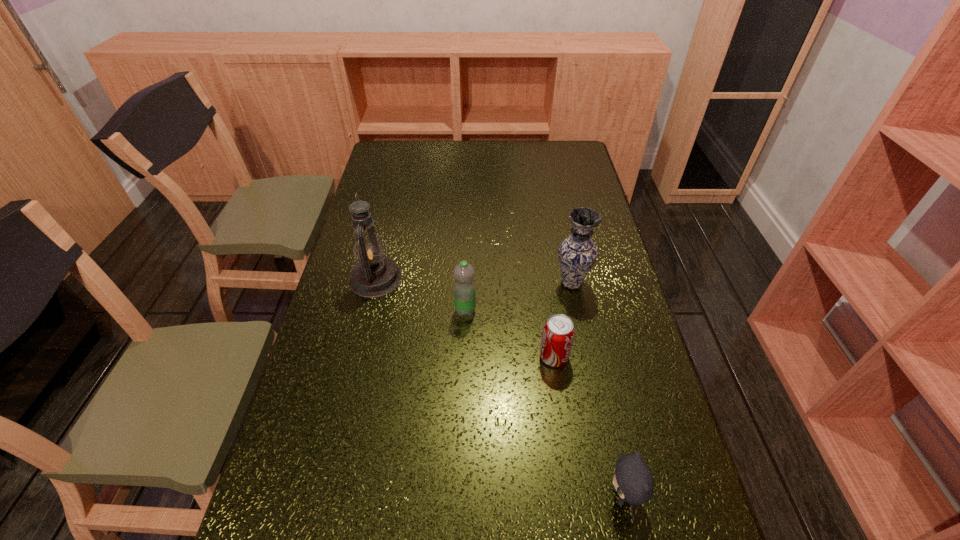
The height and width of the screenshot is (540, 960). What are the coordinates of `vacant region at the far right corner of the desktop` in the screenshot? It's located at (556, 150).

Locate an element on the screen. This screenshot has height=540, width=960. vacant region between the vase and the tallest object is located at coordinates coord(473,281).

In order to click on free space between the kitten and the soda in this screenshot , I will do `click(588, 426)`.

You are a GUI agent. You are given a task and a screenshot of the screen. Output one action in this format:
    pyautogui.click(x=<x>, y=<y>)
    Task: Click on the free spot between the leftmost object and the second nearest object
    The height and width of the screenshot is (540, 960).
    Given the screenshot: What is the action you would take?
    pyautogui.click(x=465, y=318)

Identify the location of unoccupied area between the water bottle and the kitten. (544, 403).

The image size is (960, 540). Find the location of `free spot between the fourth shortest object and the kitten`. free spot between the fourth shortest object and the kitten is located at coordinates (597, 389).

Where is `vacant region between the second tallest object and the water bottle`? Image resolution: width=960 pixels, height=540 pixels. vacant region between the second tallest object and the water bottle is located at coordinates (518, 297).

What are the coordinates of `empty space between the oil lamp and the fourth object from right to left` in the screenshot? It's located at (420, 294).

At what (x,y) coordinates should I click in order to perform the action: click on free spot between the second nearest object and the second object from left to right. Please return your answer as a coordinate pair (x, y). Looking at the image, I should click on (510, 334).

You are a GUI agent. You are given a task and a screenshot of the screen. Output one action in this format:
    pyautogui.click(x=<x>, y=<y>)
    Task: Click on the free space between the nearest object and the water bottle
    
    Given the screenshot: What is the action you would take?
    [544, 403]